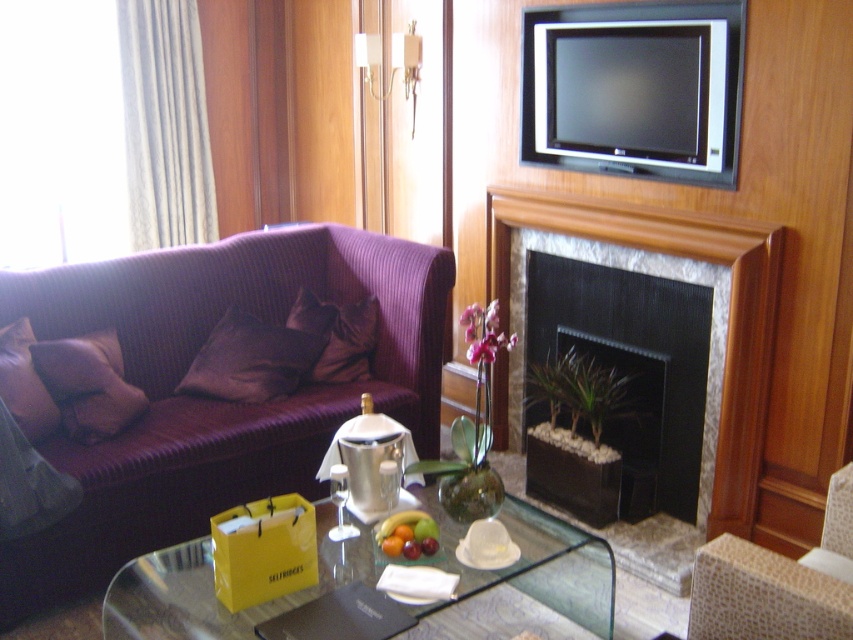
Question: Which of these objects is positioned closest to the glossy plastic fruit bowl at center?

Choices:
 (A) black stone fireplace at center
 (B) transparent glass table at center

Answer: (B)

Question: In this image, where is purple corduroy couch at center located relative to black stone fireplace at center?

Choices:
 (A) right
 (B) left

Answer: (B)

Question: Does transparent glass table at center appear on the right side of glossy plastic fruit bowl at center?

Choices:
 (A) yes
 (B) no

Answer: (B)

Question: Is transparent glass table at center closer to the viewer compared to leather at right?

Choices:
 (A) no
 (B) yes

Answer: (A)

Question: Which object is closer to the camera taking this photo?

Choices:
 (A) black stone fireplace at center
 (B) glossy plastic fruit bowl at center
 (C) purple corduroy couch at center
 (D) leather at right

Answer: (D)

Question: Which of these objects is positioned farthest from the leather at right?

Choices:
 (A) black marble fireplace at center
 (B) black stone fireplace at center

Answer: (B)